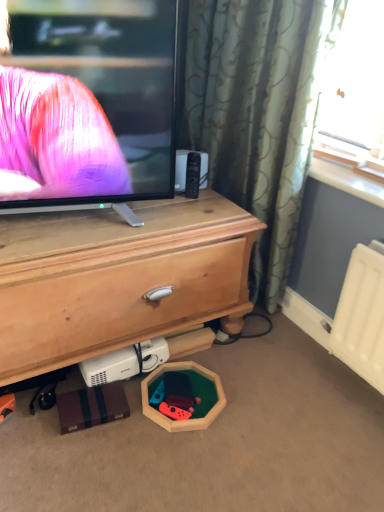
Locate an element on the screen. This screenshot has width=384, height=512. free space to the right of wooden hexagon at lower center, the 1th toy viewed from the left is located at coordinates (210, 400).